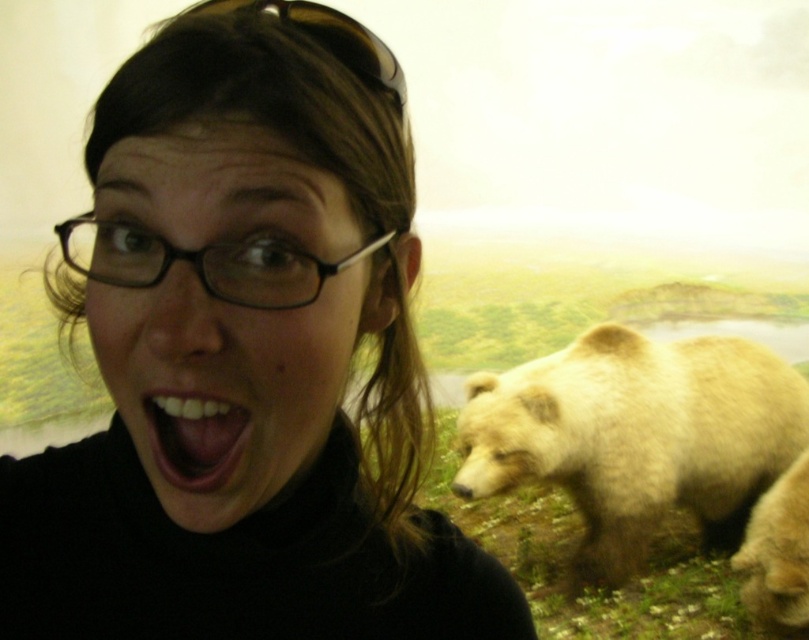
Question: Is fuzzy beige bear at lower right positioned behind fuzzy brown bear at right?

Choices:
 (A) yes
 (B) no

Answer: (A)

Question: Can you confirm if black matte turtleneck at upper left is positioned to the left of black plastic glasses at center?

Choices:
 (A) no
 (B) yes

Answer: (A)

Question: Among these points, which one is nearest to the camera?

Choices:
 (A) (244, 564)
 (B) (481, 460)

Answer: (A)

Question: Can you confirm if black plastic glasses at center is bigger than fuzzy brown bear at right?

Choices:
 (A) yes
 (B) no

Answer: (B)

Question: Which of these objects is positioned farthest from the fuzzy brown bear at right?

Choices:
 (A) white glossy teeth at center
 (B) black plastic glasses at center

Answer: (A)

Question: Among these points, which one is farthest from the camera?

Choices:
 (A) (229, 275)
 (B) (274, 193)

Answer: (A)